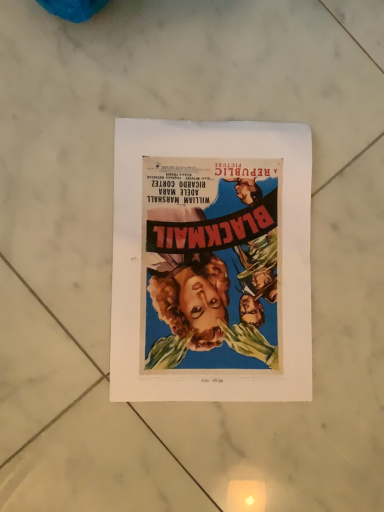
Locate an element on the screen. matte paper poster at center is located at coordinates point(211,262).

Image resolution: width=384 pixels, height=512 pixels. What do you see at coordinates (211, 262) in the screenshot?
I see `matte paper poster at center` at bounding box center [211, 262].

Find the location of `matte paper poster at center`. matte paper poster at center is located at coordinates (211, 262).